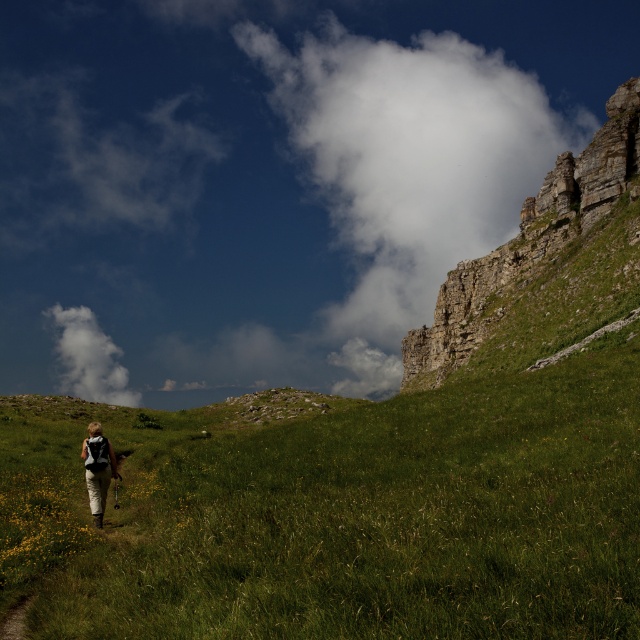
Question: Which object is farther from the camera taking this photo?

Choices:
 (A) khaki pants at center
 (B) white fluffy cloud at upper left
 (C) rugged stone cliff at upper right

Answer: (B)

Question: Considering the relative positions of white fluffy cloud at upper center and rugged stone cliff at upper right in the image provided, where is white fluffy cloud at upper center located with respect to rugged stone cliff at upper right?

Choices:
 (A) right
 (B) left

Answer: (A)

Question: Does white fluffy cloud at upper center have a larger size compared to white fluffy cloud at upper left?

Choices:
 (A) no
 (B) yes

Answer: (B)

Question: Is white fluffy cloud at upper center to the right of white fluffy cloud at upper left from the viewer's perspective?

Choices:
 (A) no
 (B) yes

Answer: (B)

Question: Among these objects, which one is nearest to the camera?

Choices:
 (A) rugged stone cliff at upper right
 (B) khaki pants at center
 (C) white fluffy cloud at upper left
 (D) white fluffy cloud at upper center

Answer: (B)

Question: Among these objects, which one is farthest from the camera?

Choices:
 (A) white fluffy cloud at upper center
 (B) rugged stone cliff at upper right
 (C) khaki pants at center

Answer: (A)